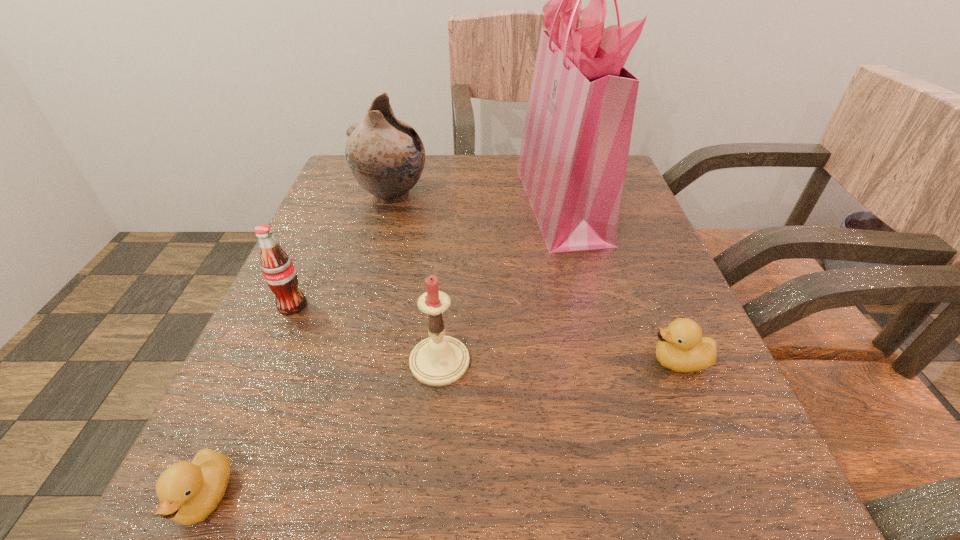
Locate an element on the screen. duckling at the left edge is located at coordinates (188, 492).

In order to click on shopping bag located at the right edge in this screenshot , I will do `click(573, 158)`.

Identify the location of duckling located in the right edge section of the desktop. Image resolution: width=960 pixels, height=540 pixels. (681, 347).

At what (x,y) coordinates should I click in order to perform the action: click on object at the far left corner. Please return your answer as a coordinate pair (x, y). The image size is (960, 540). Looking at the image, I should click on (385, 155).

The image size is (960, 540). What are the coordinates of `object that is at the near left corner` in the screenshot? It's located at (188, 492).

Where is `object that is at the far right corner`? The width and height of the screenshot is (960, 540). object that is at the far right corner is located at coordinates (573, 158).

Identify the location of blank area at the far edge. (520, 202).

Image resolution: width=960 pixels, height=540 pixels. I want to click on vacant space at the near edge of the desktop, so click(x=511, y=458).

In order to click on vacant region at the left edge in this screenshot , I will do `click(296, 408)`.

Locate an element on the screen. vacant region at the right edge of the desktop is located at coordinates (646, 330).